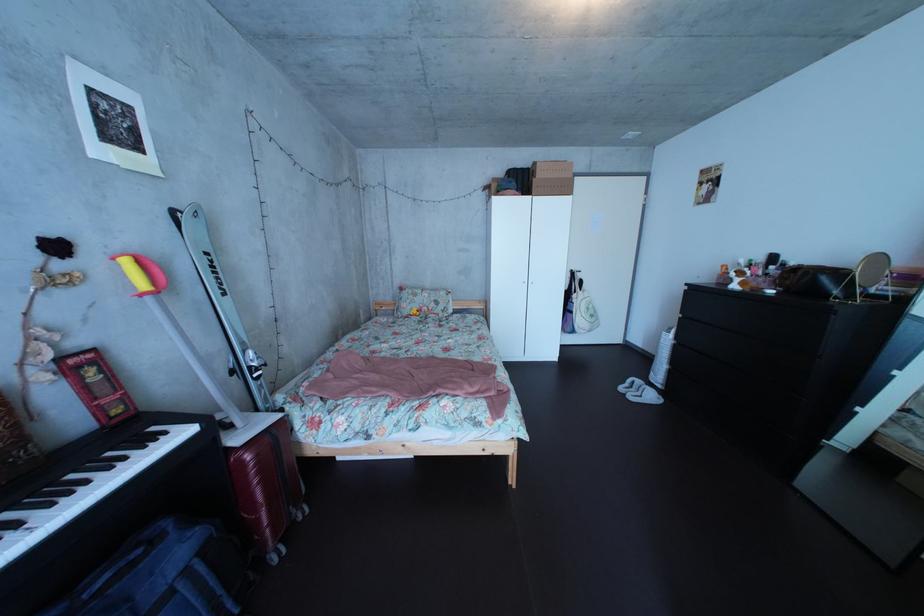
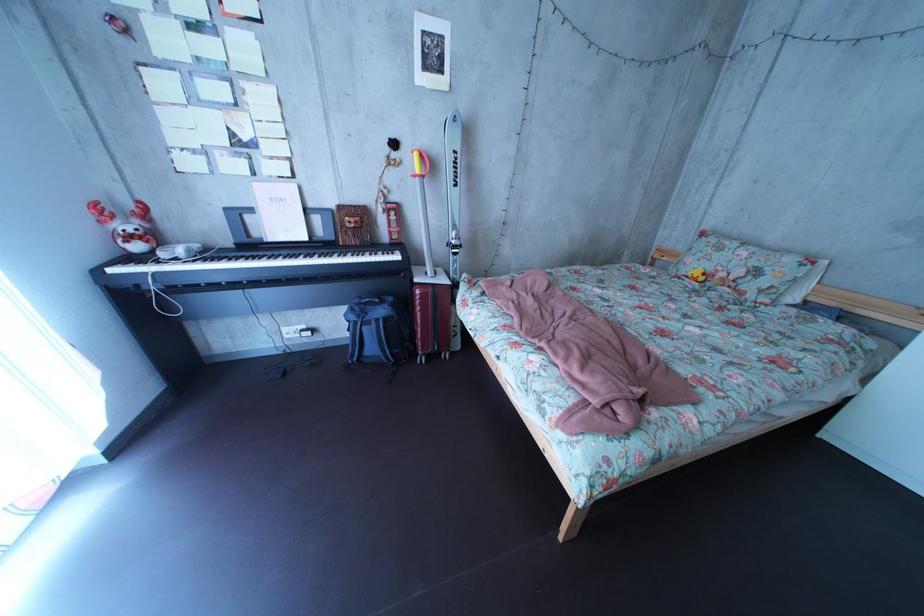
Locate, in the second image, the point that corresponds to point (430, 307) in the first image.

(731, 262)